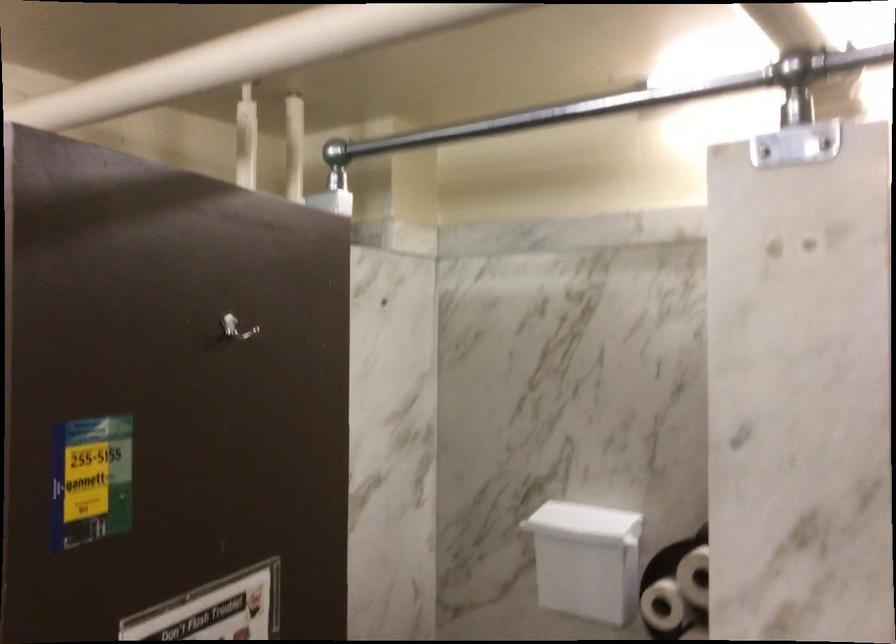
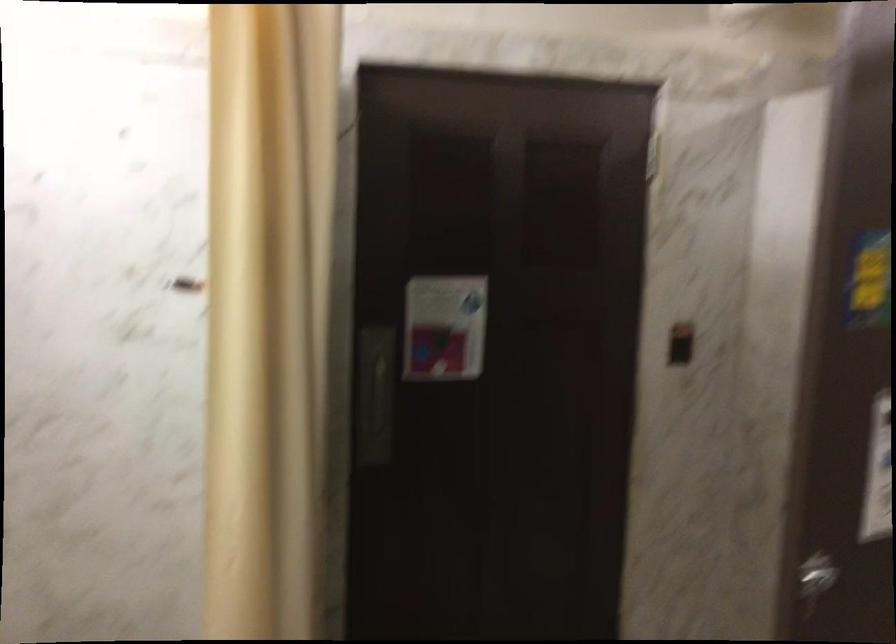
Question: The first image is from the beginning of the video and the second image is from the end. How did the camera likely rotate when shooting the video?

Choices:
 (A) Left
 (B) Right
 (C) Up
 (D) Down

Answer: (A)